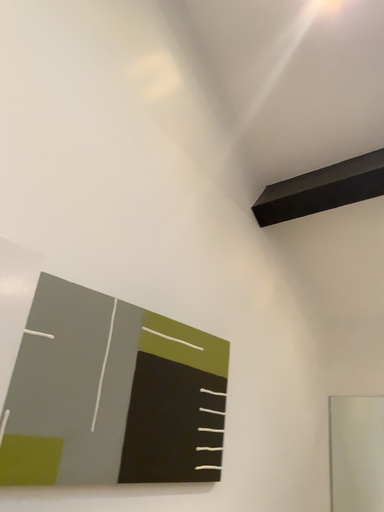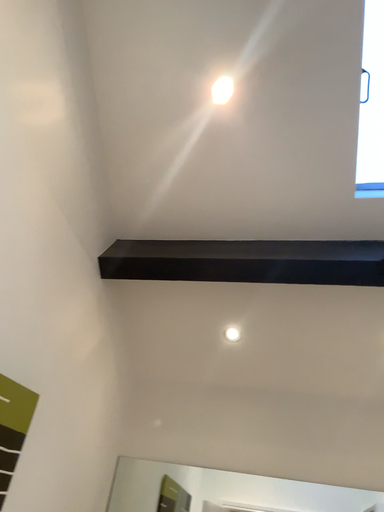
Question: Which way did the camera rotate in the video?

Choices:
 (A) rotated right
 (B) rotated left

Answer: (A)